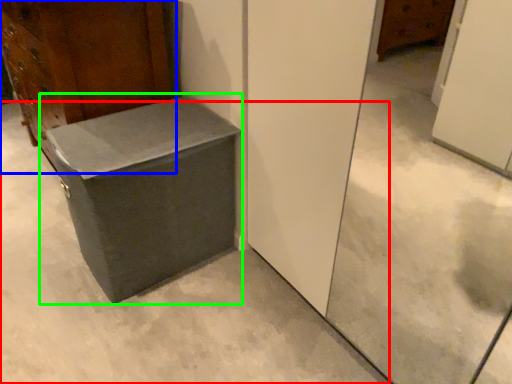
Question: Considering the real-world distances, which object is farthest from concrete (highlighted by a red box)? furniture (highlighted by a blue box) or cardboard box (highlighted by a green box)?

Choices:
 (A) furniture
 (B) cardboard box

Answer: (A)